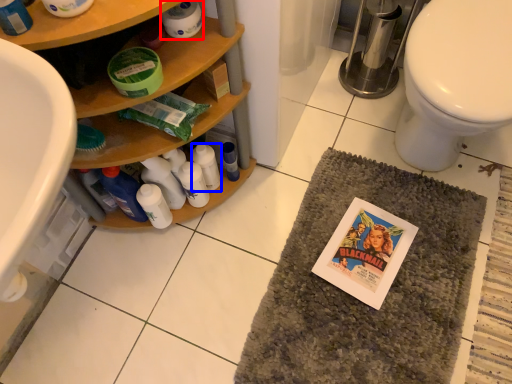
Question: Among these objects, which one is nearest to the camera, toilet paper (highlighted by a red box) or bottle (highlighted by a blue box)?

Choices:
 (A) toilet paper
 (B) bottle

Answer: (A)